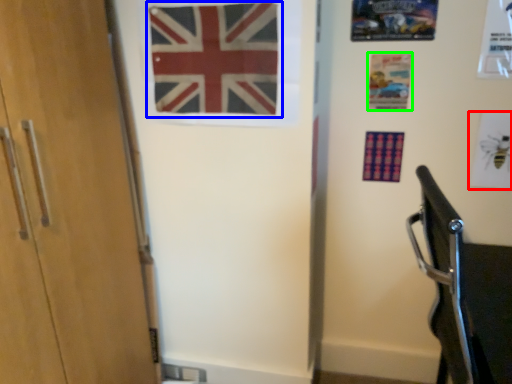
Question: Which object is positioned closest to postcard (highlighted by a red box)? Select from flag (highlighted by a blue box) and postcard (highlighted by a green box).

Choices:
 (A) flag
 (B) postcard

Answer: (B)